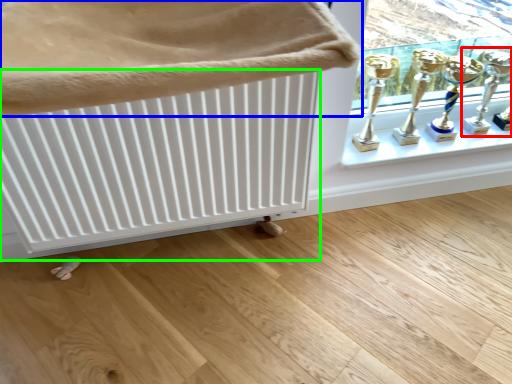
Question: Based on their relative distances, which object is nearer to candle holder (highlighted by a red box)? Choose from furniture (highlighted by a blue box) and radiator (highlighted by a green box).

Choices:
 (A) furniture
 (B) radiator

Answer: (B)